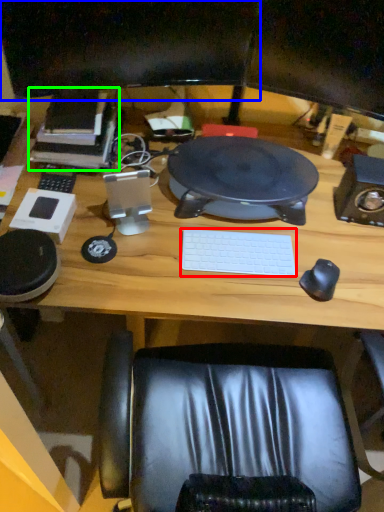
Question: Which is farther away from laptop keyboard (highlighted by a red box)? computer monitor (highlighted by a blue box) or book (highlighted by a green box)?

Choices:
 (A) computer monitor
 (B) book

Answer: (A)